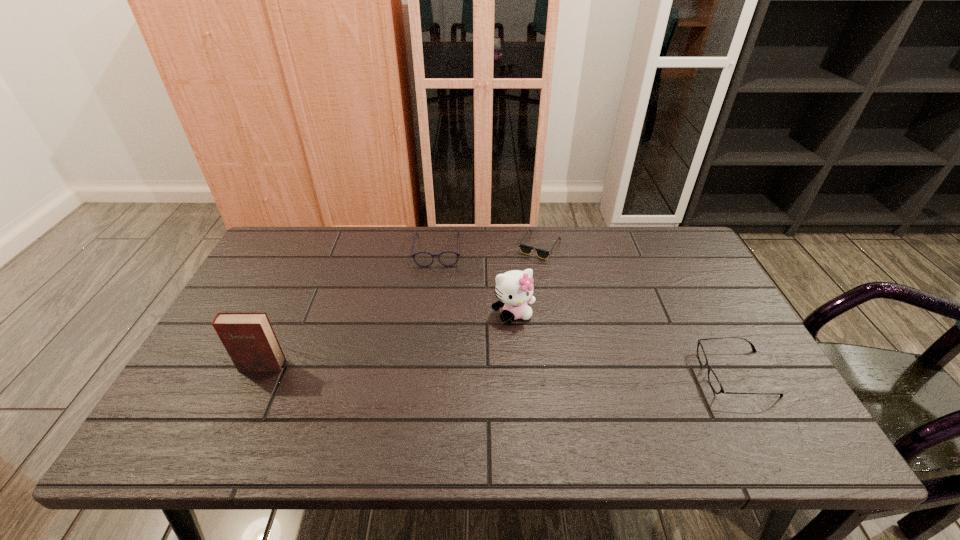
In order to click on blank area located on the lenses of the sunglasses in this screenshot , I will do `click(564, 356)`.

Find the location of `spectacles that is at the far edge`. spectacles that is at the far edge is located at coordinates (447, 258).

Where is `sunglasses positioned at the far edge`? sunglasses positioned at the far edge is located at coordinates (525, 249).

This screenshot has height=540, width=960. I want to click on object present at the near edge, so click(x=713, y=379).

Image resolution: width=960 pixels, height=540 pixels. Find the location of `object present at the left edge`. object present at the left edge is located at coordinates (248, 337).

This screenshot has width=960, height=540. Find the location of `object that is at the right edge`. object that is at the right edge is located at coordinates (713, 379).

At what (x,y) coordinates should I click in order to perform the action: click on object that is at the near right corner. Please return your answer as a coordinate pair (x, y). This screenshot has width=960, height=540. Looking at the image, I should click on (713, 379).

The height and width of the screenshot is (540, 960). Identify the location of free region at the far edge. (364, 233).

At what (x,y) coordinates should I click in order to perform the action: click on vacant space at the near edge of the desktop. Please return your answer as a coordinate pair (x, y). The width and height of the screenshot is (960, 540). Looking at the image, I should click on (283, 394).

This screenshot has width=960, height=540. Identify the location of vacant region at the right edge of the desktop. (667, 287).